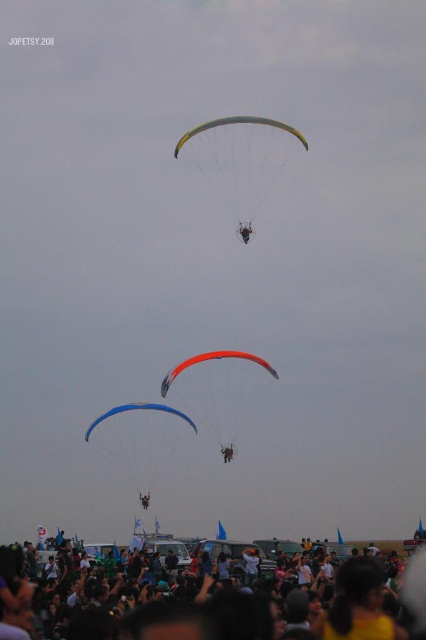
Question: Does matte black crowd at lower center have a smaller size compared to orange matte parachute at center?

Choices:
 (A) no
 (B) yes

Answer: (A)

Question: Which object is closer to the camera taking this photo?

Choices:
 (A) yellow-green fabric parachute at upper center
 (B) blue matte parachute at center

Answer: (A)

Question: Which of the following is the closest to the observer?

Choices:
 (A) blue matte parachute at center
 (B) orange matte parachute at center
 (C) yellow-green fabric parachute at upper center

Answer: (B)

Question: Does yellow-green fabric parachute at upper center have a greater width compared to blue matte parachute at center?

Choices:
 (A) no
 (B) yes

Answer: (A)

Question: Estimate the real-world distances between objects in this image. Which object is closer to the orange matte parachute at center?

Choices:
 (A) matte black crowd at lower center
 (B) blue matte parachute at center

Answer: (B)

Question: Does yellow-green fabric parachute at upper center lie behind blue matte parachute at center?

Choices:
 (A) yes
 (B) no

Answer: (B)